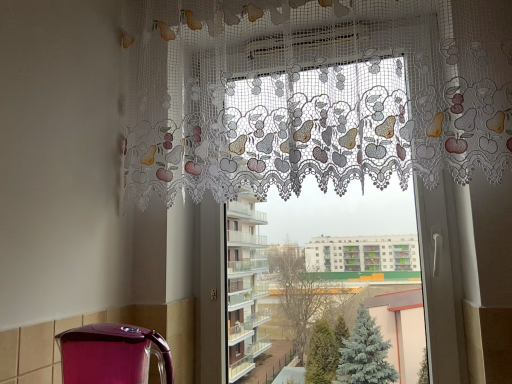
Locate an element on the screen. white lace curtain at upper center is located at coordinates (327, 104).

At what (x,y) coordinates should I click in order to perform the action: click on lace fabric curtain at upper center. Please return your answer as a coordinate pair (x, y). The height and width of the screenshot is (384, 512). Looking at the image, I should click on (316, 95).

From the image's perspective, is shiny purple kettle at lower left on white lace curtain at upper center?

No, from the image's perspective, shiny purple kettle at lower left is not above white lace curtain at upper center.

Considering the positions of objects shiny purple kettle at lower left and white lace curtain at upper center in the image provided, who is behind, shiny purple kettle at lower left or white lace curtain at upper center?

white lace curtain at upper center is further away from the camera.

From a real-world perspective, which is physically above, shiny purple kettle at lower left or white lace curtain at upper center?

white lace curtain at upper center is physically above.

Which object is positioned more to the left, shiny purple kettle at lower left or white lace curtain at upper center?

shiny purple kettle at lower left is more to the left.

Are white lace curtain at upper center and lace fabric curtain at upper center far apart?

No, white lace curtain at upper center is not far from lace fabric curtain at upper center.

Can you confirm if white lace curtain at upper center is positioned to the right of lace fabric curtain at upper center?

Correct, you'll find white lace curtain at upper center to the right of lace fabric curtain at upper center.

Identify the location of window frame on the right of lace fabric curtain at upper center. (327, 104).

Looking at their sizes, would you say white lace curtain at upper center is wider or thinner than lace fabric curtain at upper center?

In the image, white lace curtain at upper center appears to be more narrow than lace fabric curtain at upper center.

Based on the photo, can you confirm if white lace curtain at upper center is wider than shiny purple kettle at lower left?

In fact, white lace curtain at upper center might be narrower than shiny purple kettle at lower left.

Is the depth of white lace curtain at upper center greater than that of shiny purple kettle at lower left?

Yes, white lace curtain at upper center is further from the viewer.

Is white lace curtain at upper center to the right of shiny purple kettle at lower left from the viewer's perspective?

Indeed, white lace curtain at upper center is positioned on the right side of shiny purple kettle at lower left.

From a real-world perspective, relative to shiny purple kettle at lower left, is white lace curtain at upper center vertically above or below?

From a real-world perspective, white lace curtain at upper center is physically above shiny purple kettle at lower left.

Which is more to the left, lace fabric curtain at upper center or white lace curtain at upper center?

lace fabric curtain at upper center is more to the left.

Is lace fabric curtain at upper center oriented towards white lace curtain at upper center?

No.

Is point (435, 18) positioned in front of point (272, 116)?

Yes, it is.

From a real-world perspective, does lace fabric curtain at upper center sit lower than white lace curtain at upper center?

No.

From the image's perspective, is lace fabric curtain at upper center on shiny purple kettle at lower left?

Yes.

Is lace fabric curtain at upper center wider than shiny purple kettle at lower left?

In fact, lace fabric curtain at upper center might be narrower than shiny purple kettle at lower left.

Measure the distance between lace fabric curtain at upper center and shiny purple kettle at lower left.

lace fabric curtain at upper center is 72.30 centimeters away from shiny purple kettle at lower left.

Which is more to the left, lace fabric curtain at upper center or shiny purple kettle at lower left?

Positioned to the left is shiny purple kettle at lower left.

Consider the image. Is shiny purple kettle at lower left positioned in front of lace fabric curtain at upper center?

That is True.

From a real-world perspective, between shiny purple kettle at lower left and lace fabric curtain at upper center, who is vertically higher?

lace fabric curtain at upper center, from a real-world perspective.

What's the angular difference between shiny purple kettle at lower left and lace fabric curtain at upper center's facing directions?

The angular difference between shiny purple kettle at lower left and lace fabric curtain at upper center is 1.47 degrees.

Can you confirm if shiny purple kettle at lower left is wider than lace fabric curtain at upper center?

Yes.

Where is `appliance in front of the white lace curtain at upper center`? appliance in front of the white lace curtain at upper center is located at coordinates (112, 354).

Where is `window frame below the lace fabric curtain at upper center (from the image's perspective)`? Image resolution: width=512 pixels, height=384 pixels. window frame below the lace fabric curtain at upper center (from the image's perspective) is located at coordinates (327, 104).

Based on their spatial positions, is white lace curtain at upper center or shiny purple kettle at lower left closer to lace fabric curtain at upper center?

white lace curtain at upper center is positioned closer to the anchor lace fabric curtain at upper center.

Estimate the real-world distances between objects in this image. Which object is further from white lace curtain at upper center, shiny purple kettle at lower left or lace fabric curtain at upper center?

shiny purple kettle at lower left is further to white lace curtain at upper center.

From the image, which object appears to be farther from shiny purple kettle at lower left, lace fabric curtain at upper center or white lace curtain at upper center?

lace fabric curtain at upper center is positioned further to the anchor shiny purple kettle at lower left.

Looking at this image, considering their positions, is white lace curtain at upper center positioned further to shiny purple kettle at lower left than lace fabric curtain at upper center?

lace fabric curtain at upper center lies further to shiny purple kettle at lower left than the other object.

Which object lies further to the anchor point lace fabric curtain at upper center, shiny purple kettle at lower left or white lace curtain at upper center?

The object further to lace fabric curtain at upper center is shiny purple kettle at lower left.

Looking at the image, which one is located further to white lace curtain at upper center, lace fabric curtain at upper center or shiny purple kettle at lower left?

Based on the image, shiny purple kettle at lower left appears to be further to white lace curtain at upper center.

I want to click on window frame that lies between lace fabric curtain at upper center and shiny purple kettle at lower left from top to bottom, so click(x=327, y=104).